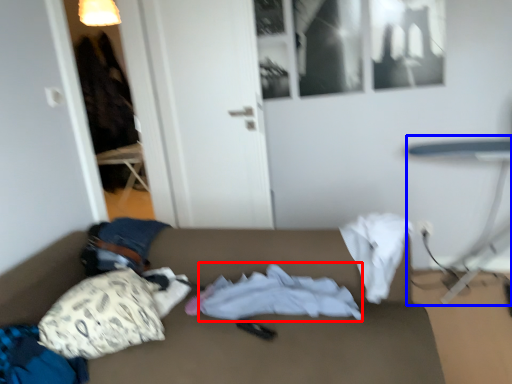
Question: Which of the following is the closest to the observer, sheet (highlighted by a red box) or table (highlighted by a blue box)?

Choices:
 (A) sheet
 (B) table

Answer: (A)